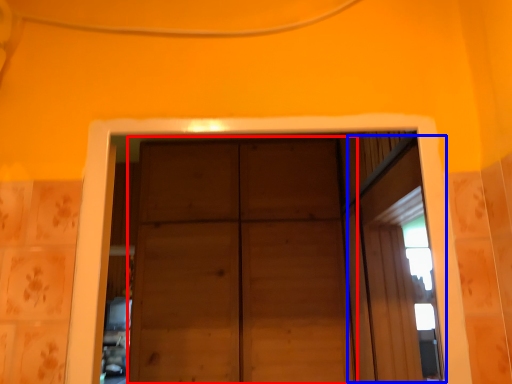
Question: Which object is further to the camera taking this photo, door (highlighted by a red box) or window (highlighted by a blue box)?

Choices:
 (A) door
 (B) window

Answer: (A)